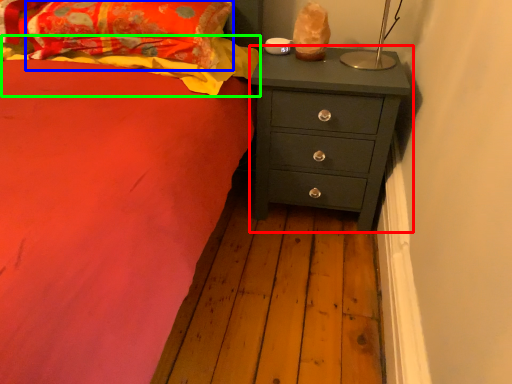
Question: Estimate the real-world distances between objects in this image. Which object is farther from chest of drawers (highlighted by a red box), pillow (highlighted by a blue box) or blanket (highlighted by a green box)?

Choices:
 (A) pillow
 (B) blanket

Answer: (A)